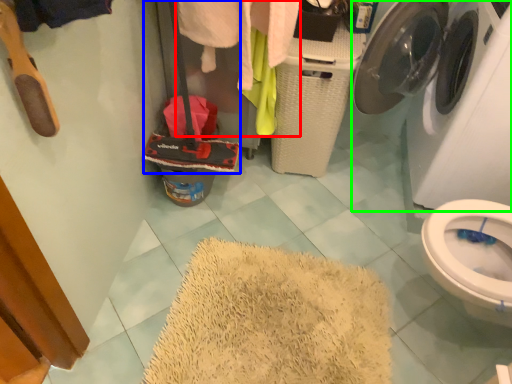
Question: Estimate the real-world distances between objects in this image. Which object is closer to clothing (highlighted by a red box), luggage (highlighted by a blue box) or washing machine (highlighted by a green box)?

Choices:
 (A) luggage
 (B) washing machine

Answer: (A)